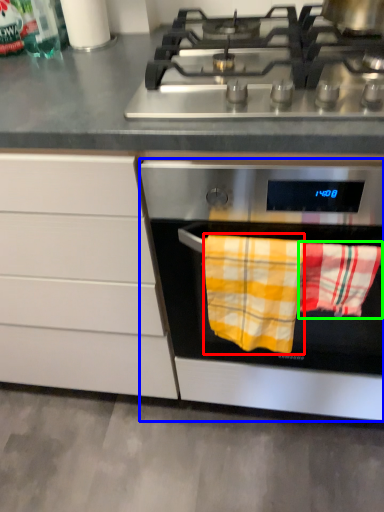
Question: Which object is the farthest from beach towel (highlighted by a red box)? Choose among these: oven (highlighted by a blue box) or beach towel (highlighted by a green box).

Choices:
 (A) oven
 (B) beach towel

Answer: (A)